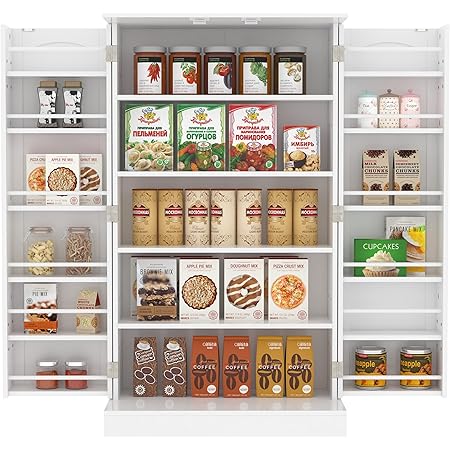
Identify the location of hinges. This screenshot has width=450, height=450. (105, 52), (333, 56), (112, 215), (331, 216), (336, 369), (109, 370).